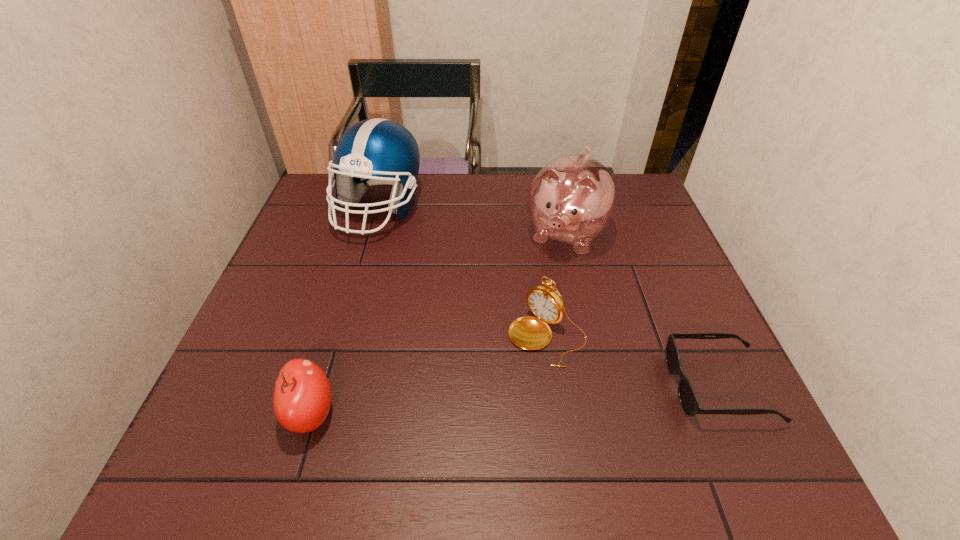
Find the location of `free location located 0.290m at the front of the football helmet with the faceguard`. free location located 0.290m at the front of the football helmet with the faceguard is located at coordinates (418, 317).

This screenshot has height=540, width=960. Find the location of `piggy bank located in the far edge section of the desktop`. piggy bank located in the far edge section of the desktop is located at coordinates (572, 198).

Find the location of a particular element. The image size is (960, 540). football helmet that is at the far edge is located at coordinates (377, 151).

At what (x,y) coordinates should I click in order to perform the action: click on apple that is at the near edge. Please return your answer as a coordinate pair (x, y). This screenshot has width=960, height=540. Looking at the image, I should click on (302, 395).

Find the location of a particular element. The width and height of the screenshot is (960, 540). sunglasses present at the near edge is located at coordinates (688, 399).

This screenshot has width=960, height=540. Find the location of `apple that is at the left edge`. apple that is at the left edge is located at coordinates (302, 395).

The image size is (960, 540). What are the coordinates of `football helmet that is at the left edge` in the screenshot? It's located at (377, 151).

At what (x,y) coordinates should I click in order to perform the action: click on sunglasses situated at the right edge. Please return your answer as a coordinate pair (x, y). Looking at the image, I should click on (688, 399).

This screenshot has width=960, height=540. In order to click on piggy bank that is positioned at the right edge in this screenshot , I will do `click(572, 198)`.

Locate an element on the screen. The height and width of the screenshot is (540, 960). object located at the far left corner is located at coordinates (377, 151).